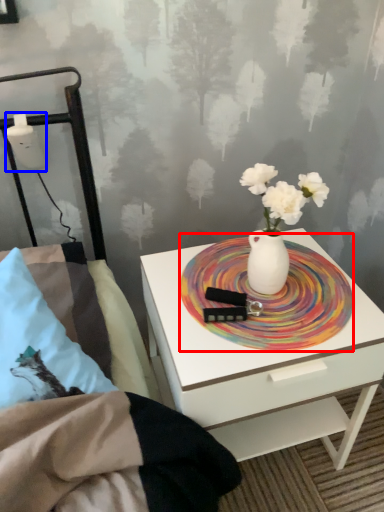
Question: Which object is further to the camera taking this photo, platter (highlighted by a red box) or table lamp (highlighted by a blue box)?

Choices:
 (A) platter
 (B) table lamp

Answer: (B)